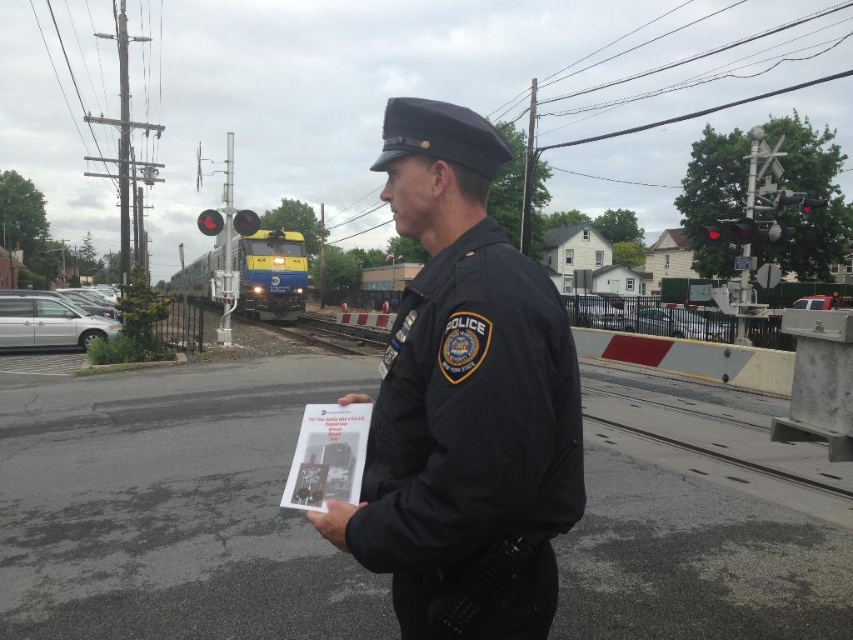
Can you confirm if black fabric police uniform at center is thinner than white paper at center?

No.

Which is behind, point (403, 310) or point (300, 499)?

Positioned behind is point (300, 499).

You are a GUI agent. You are given a task and a screenshot of the screen. Output one action in this format:
    pyautogui.click(x=<x>, y=<y>)
    Task: Click on the black fabric police uniform at center
    The image size is (853, 640).
    Given the screenshot: What is the action you would take?
    pyautogui.click(x=473, y=445)

Can you confirm if black fabric police uniform at center is taller than smooth concrete train track at center?

Incorrect, black fabric police uniform at center's height is not larger of smooth concrete train track at center's.

Between black fabric police uniform at center and smooth concrete train track at center, which one has more height?

Standing taller between the two is smooth concrete train track at center.

Where is `black fabric police uniform at center`? black fabric police uniform at center is located at coordinates (473, 445).

Who is positioned more to the left, smooth concrete train track at center or white paper at center?

smooth concrete train track at center

Can you confirm if smooth concrete train track at center is wider than white paper at center?

Yes, smooth concrete train track at center is wider than white paper at center.

The width and height of the screenshot is (853, 640). Describe the element at coordinates (703, 401) in the screenshot. I see `smooth concrete train track at center` at that location.

Locate an element on the screen. smooth concrete train track at center is located at coordinates (703, 401).